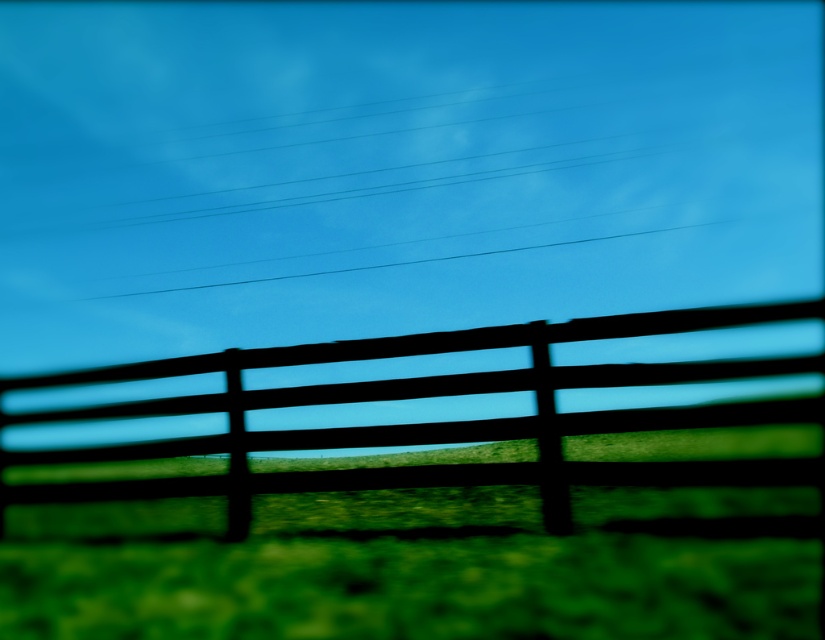
Can you confirm if green matte grass at center is positioned above black wood fence at center?

No, green matte grass at center is not above black wood fence at center.

Who is more forward, (x=629, y=582) or (x=632, y=480)?

Point (x=629, y=582)

Between point (255, 545) and point (79, 413), which one is positioned behind?

The point (79, 413) is more distant.

This screenshot has width=825, height=640. What are the coordinates of `green matte grass at center` in the screenshot? It's located at (420, 566).